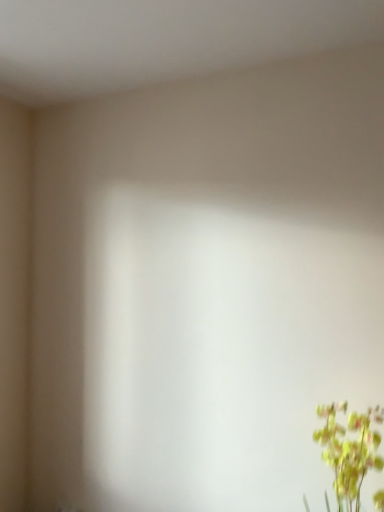
What do you see at coordinates (349, 450) in the screenshot?
I see `yellow matte flower at lower right` at bounding box center [349, 450].

Where is `yellow matte flower at lower right`? yellow matte flower at lower right is located at coordinates (349, 450).

Measure the distance between yellow matte flower at lower right and camera.

The depth of yellow matte flower at lower right is 4.89 feet.

At what (x,y) coordinates should I click in order to perform the action: click on yellow matte flower at lower right. Please return your answer as a coordinate pair (x, y). The width and height of the screenshot is (384, 512). Looking at the image, I should click on (349, 450).